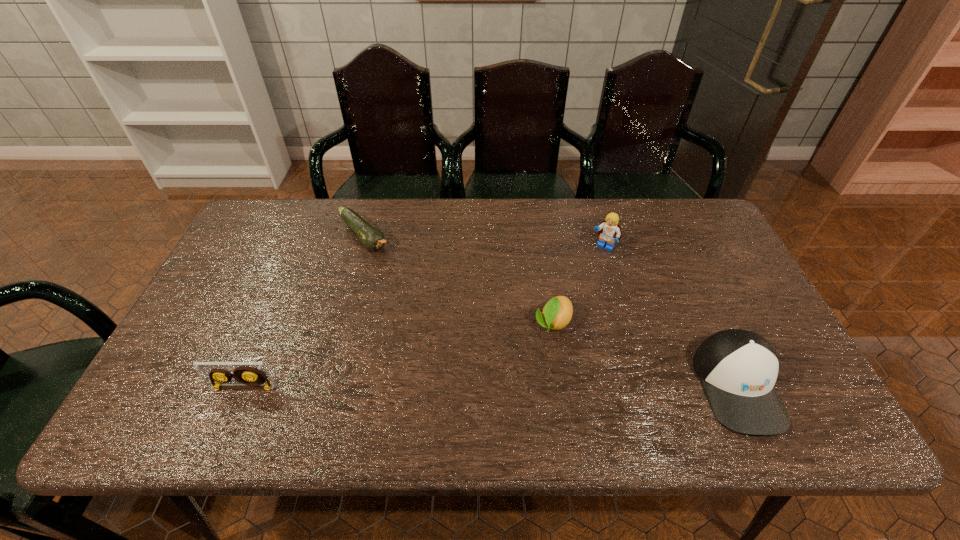
Where is `vacant spot on the desktop that is between the videotape and the rightmost object and is positioned with leaves positioned above the third object from right to left`? Image resolution: width=960 pixels, height=540 pixels. vacant spot on the desktop that is between the videotape and the rightmost object and is positioned with leaves positioned above the third object from right to left is located at coordinates (519, 387).

Locate an element on the screen. vacant spot on the desktop that is between the videotape and the rightmost object and is positioned on the front-facing side of the Lego is located at coordinates (511, 387).

Locate an element on the screen. vacant spot on the desktop that is between the videotape and the cap and is positioned at the blossom end of the fourth object from right to left is located at coordinates (496, 387).